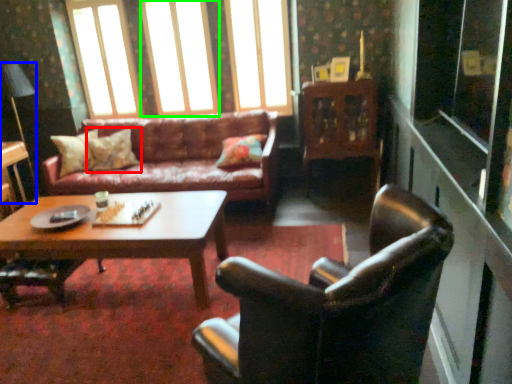
Question: Based on their relative distances, which object is farther from pillow (highlighted by a red box)? Choose from lamp (highlighted by a blue box) and window (highlighted by a green box).

Choices:
 (A) lamp
 (B) window

Answer: (A)